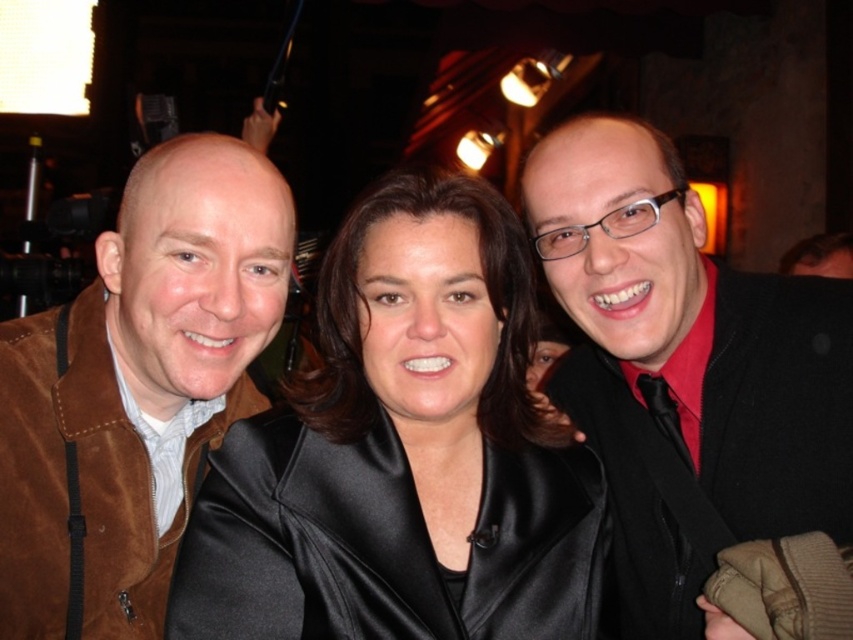
Based on the coordinates provided, which object corresponds to the point at (403, 452)?

The point at (403, 452) corresponds to the satin black jacket at center.

You are a costume designer preparing for a play and need to choose between the black matte jacket at center and the suede jacket at left for a character who requires a more imposing presence. Based on the image, which jacket would you recommend and why?

The black matte jacket at center has a larger size compared to the suede jacket at left, making it a better choice for creating an imposing presence due to its bigger and more substantial appearance.